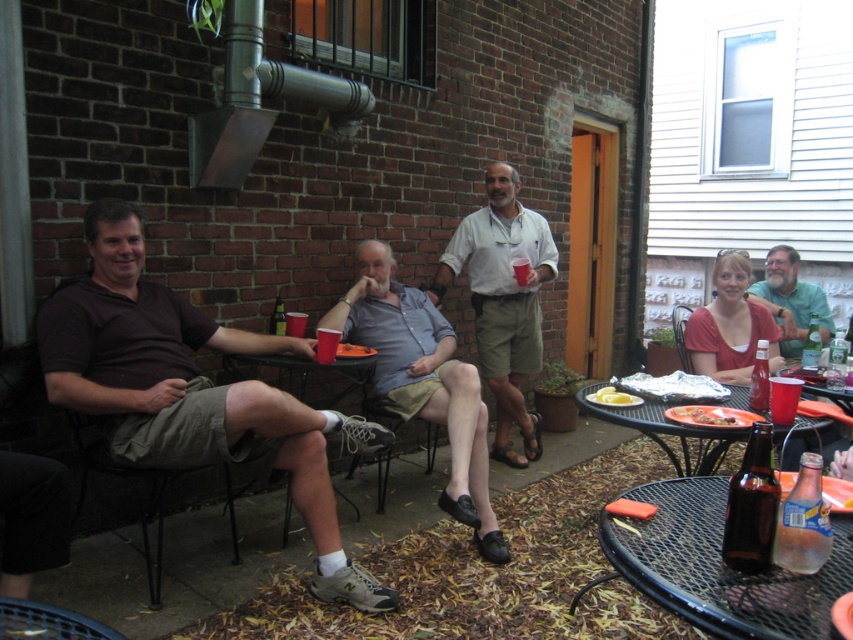
Question: Among these objects, which one is nearest to the camera?

Choices:
 (A) clear plastic cup at upper right
 (B) orange plastic plate at lower right
 (C) metallic silver tray at lower right
 (D) metallic silver chair at center

Answer: (B)

Question: Estimate the real-world distances between objects in this image. Which object is closer to the metallic black chair at lower left?

Choices:
 (A) green matte shirt at upper right
 (B) matte plastic cup at center
 (C) brown fabric chair at lower left

Answer: (B)

Question: Which of these objects is positioned closest to the brown fabric chair at lower left?

Choices:
 (A) red plastic cup at center
 (B) black mesh table at lower right
 (C) brown glass bottle at lower right
 (D) clear plastic cup at upper right

Answer: (B)

Question: From the image, what is the correct spatial relationship of metallic silver chair at center in relation to yellow matte lemon at center?

Choices:
 (A) below
 (B) above

Answer: (B)

Question: Where is matte plastic cup at center located in relation to matte plastic table at center in the image?

Choices:
 (A) above
 (B) below

Answer: (B)

Question: Is clear glass bottle at lower right wider than metallic silver chair at center?

Choices:
 (A) yes
 (B) no

Answer: (B)